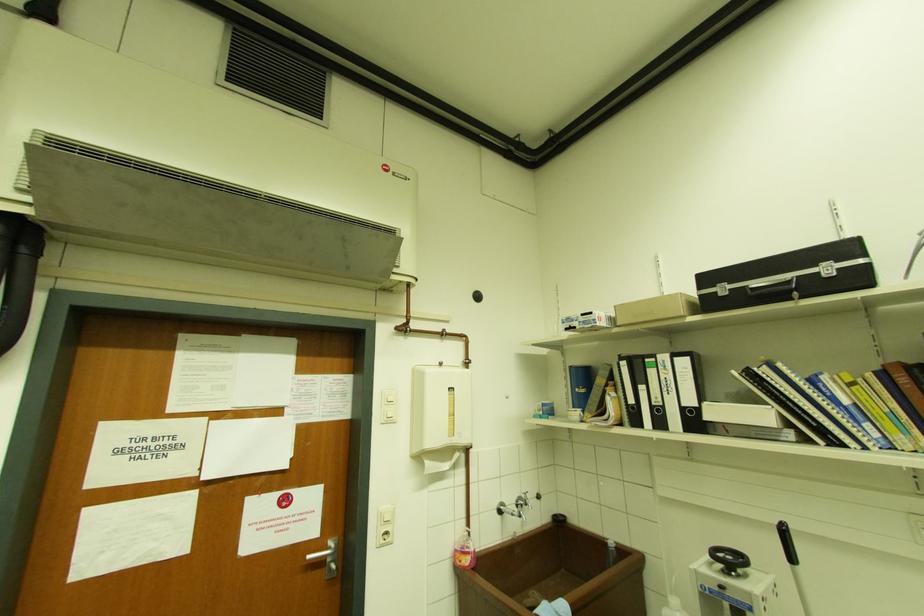
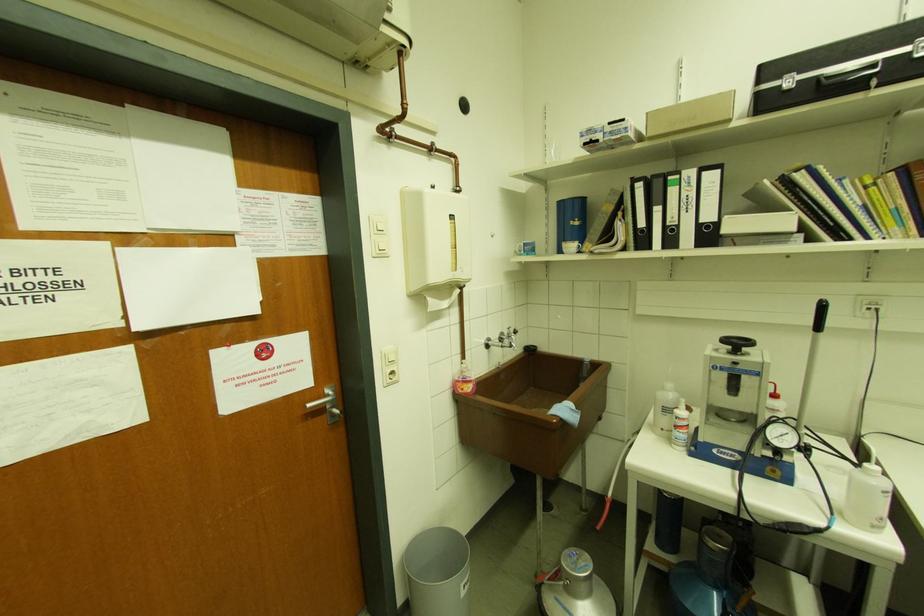
Where in the second image is the point corresponding to pixel 393 422 from the first image?

(385, 256)